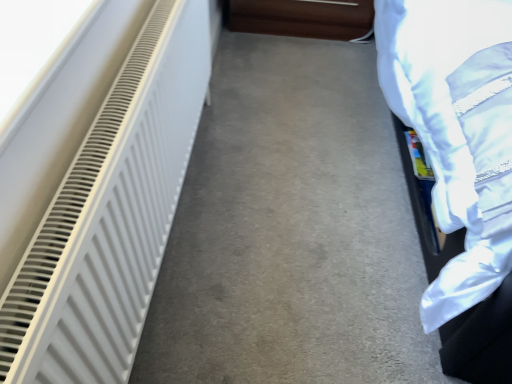
Locate an element on the screen. This screenshot has width=512, height=384. vacant area that is situated to the right of white matte radiator at left is located at coordinates (297, 238).